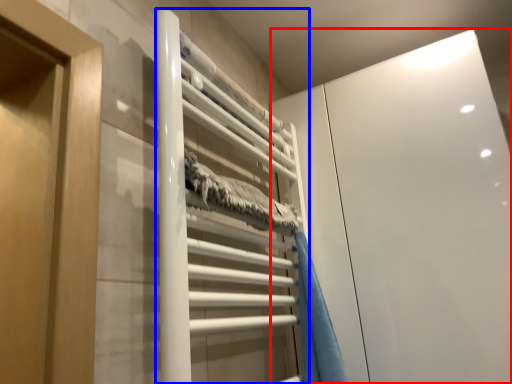
Question: Which object appears farthest to the camera in this image, glass door (highlighted by a red box) or stair (highlighted by a blue box)?

Choices:
 (A) glass door
 (B) stair

Answer: (A)